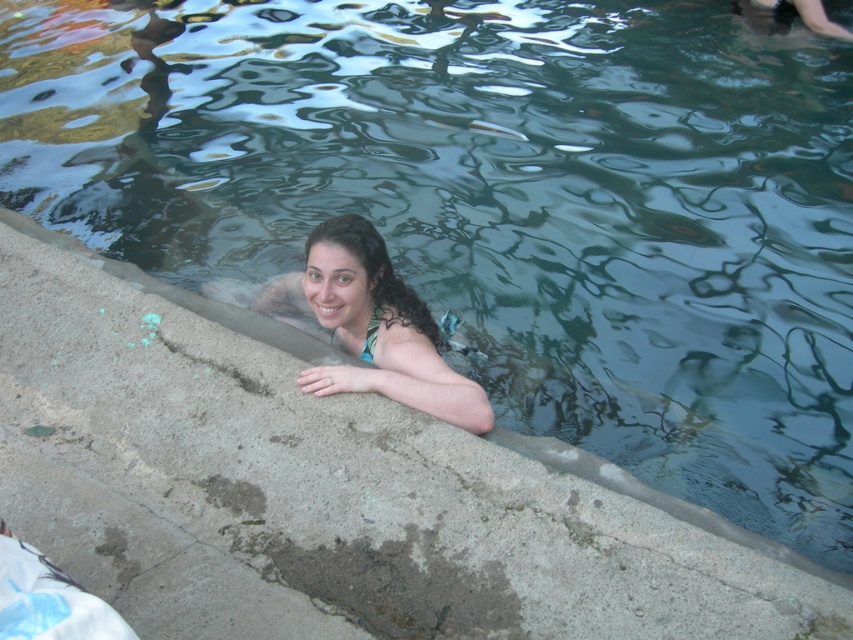
Question: Observing the image, what is the correct spatial positioning of green matte bikini top at upper center in reference to white matte bikini top at center?

Choices:
 (A) right
 (B) left

Answer: (A)

Question: Considering the real-world distances, which object is closest to the matte green bikini top at center?

Choices:
 (A) green matte bikini top at upper center
 (B) white matte bikini top at center

Answer: (B)

Question: Does green matte bikini top at upper center have a greater width compared to white matte bikini top at center?

Choices:
 (A) no
 (B) yes

Answer: (B)

Question: Is green matte bikini top at upper center positioned at the back of white matte bikini top at center?

Choices:
 (A) no
 (B) yes

Answer: (A)

Question: Which of these objects is positioned closest to the white matte bikini top at center?

Choices:
 (A) matte green bikini top at center
 (B) green matte bikini top at upper center

Answer: (B)

Question: Which of the following is the farthest from the observer?

Choices:
 (A) white matte bikini top at center
 (B) matte green bikini top at center

Answer: (A)